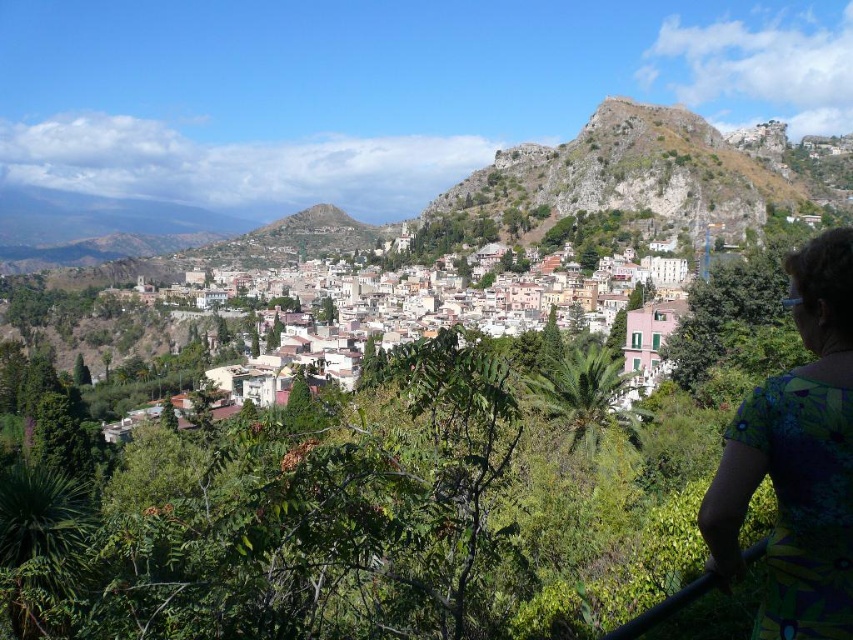
Question: Among these points, which one is nearest to the camera?

Choices:
 (A) (426, 211)
 (B) (440, 294)
 (C) (807, 292)

Answer: (C)

Question: Which of these objects is positioned farthest from the rugged stone hillside at upper right?

Choices:
 (A) green floral dress at lower right
 (B) white matte buildings at center

Answer: (A)

Question: Based on their relative distances, which object is nearer to the green floral dress at lower right?

Choices:
 (A) rugged stone hillside at upper right
 (B) white matte buildings at center

Answer: (B)

Question: Is white matte buildings at center bigger than rugged stone hillside at upper right?

Choices:
 (A) yes
 (B) no

Answer: (A)

Question: Is green floral dress at lower right to the left of rugged stone hillside at upper right from the viewer's perspective?

Choices:
 (A) no
 (B) yes

Answer: (B)

Question: Where is green floral dress at lower right located in relation to white matte buildings at center in the image?

Choices:
 (A) left
 (B) right

Answer: (B)